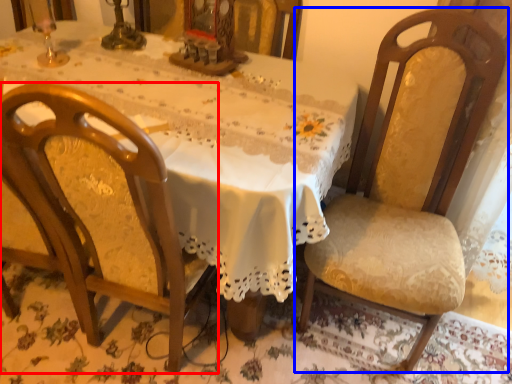
Question: Among these objects, which one is farthest to the camera, chair (highlighted by a red box) or chair (highlighted by a blue box)?

Choices:
 (A) chair
 (B) chair

Answer: (B)